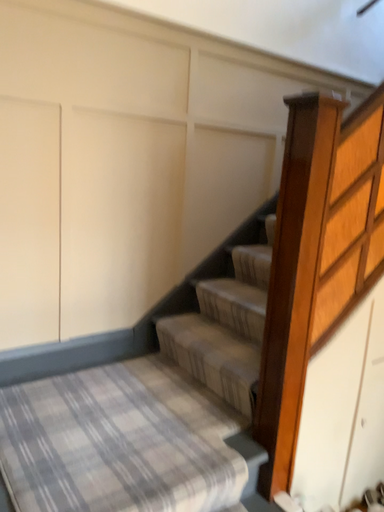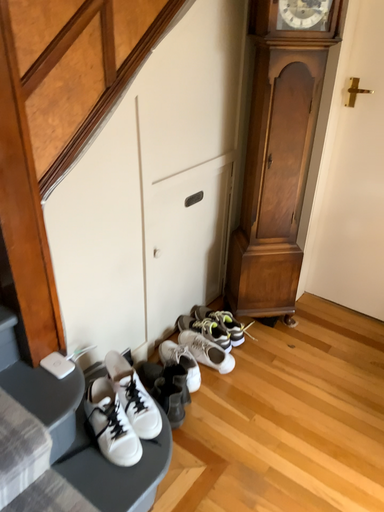
Question: Which way did the camera rotate in the video?

Choices:
 (A) rotated right
 (B) rotated left

Answer: (A)